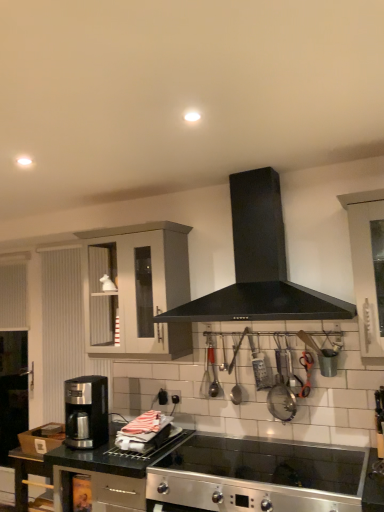
Find the location of a particular element. vacant region under black matte range hood at center (from a real-world perspective) is located at coordinates (253, 463).